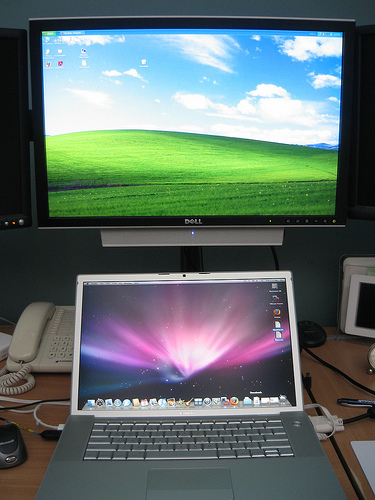
The image size is (375, 500). Identify the location of wooden desktop. (323, 379), (346, 348), (41, 454).